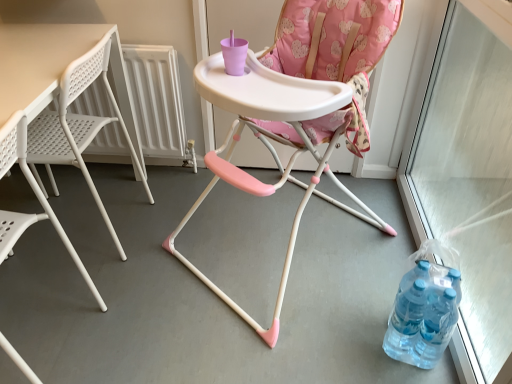
You are a GUI agent. You are given a task and a screenshot of the screen. Output one action in this format:
    pyautogui.click(x=<x>, y=<y>)
    Task: Click on the free point in front of pink plastic highchair at center, the 2th chair from the left
    This screenshot has height=384, width=512.
    Given the screenshot: What is the action you would take?
    pyautogui.click(x=275, y=342)